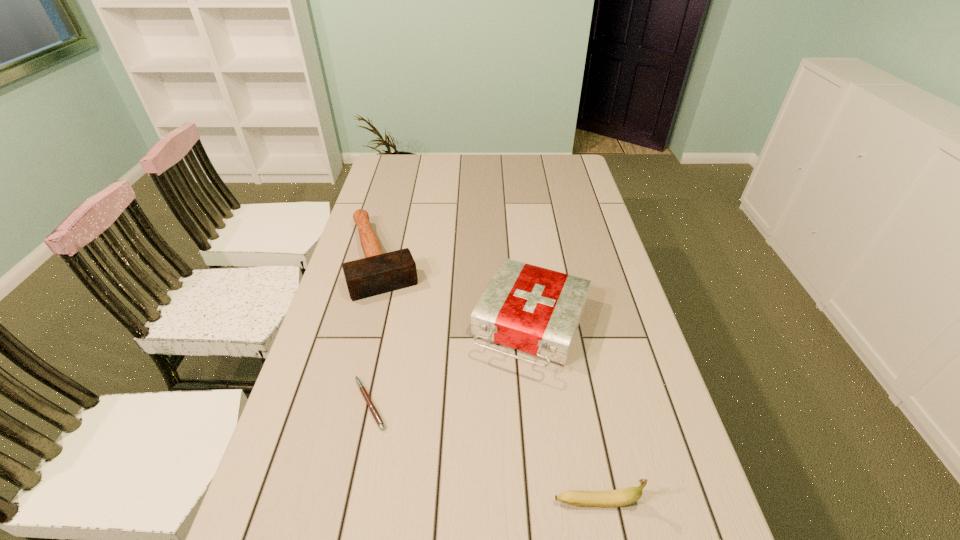
In the image, there is a desktop. Where is `vacant space at the left edge`? This screenshot has height=540, width=960. vacant space at the left edge is located at coordinates (339, 342).

Find the location of a particular element. vacant region at the right edge of the desktop is located at coordinates (589, 270).

Locate an element on the screen. The width and height of the screenshot is (960, 540). vacant region at the far left corner is located at coordinates (389, 166).

The image size is (960, 540). Identify the location of free spot at the far right corner of the desktop. (566, 157).

Where is `vacant area that lies between the mallet and the nearest object`? The height and width of the screenshot is (540, 960). vacant area that lies between the mallet and the nearest object is located at coordinates (490, 380).

I want to click on free space that is in between the banana and the mallet, so click(490, 380).

Find the location of a particular element. unoccupied position between the mallet and the first-aid kit is located at coordinates pyautogui.click(x=458, y=292).

Where is `vacant area that lies between the mallet and the banana`? This screenshot has width=960, height=540. vacant area that lies between the mallet and the banana is located at coordinates (490, 380).

Image resolution: width=960 pixels, height=540 pixels. Identify the location of empty space between the pen and the first-aid kit. (451, 364).

Where is `free space between the mallet and the pen`? The height and width of the screenshot is (540, 960). free space between the mallet and the pen is located at coordinates (376, 331).